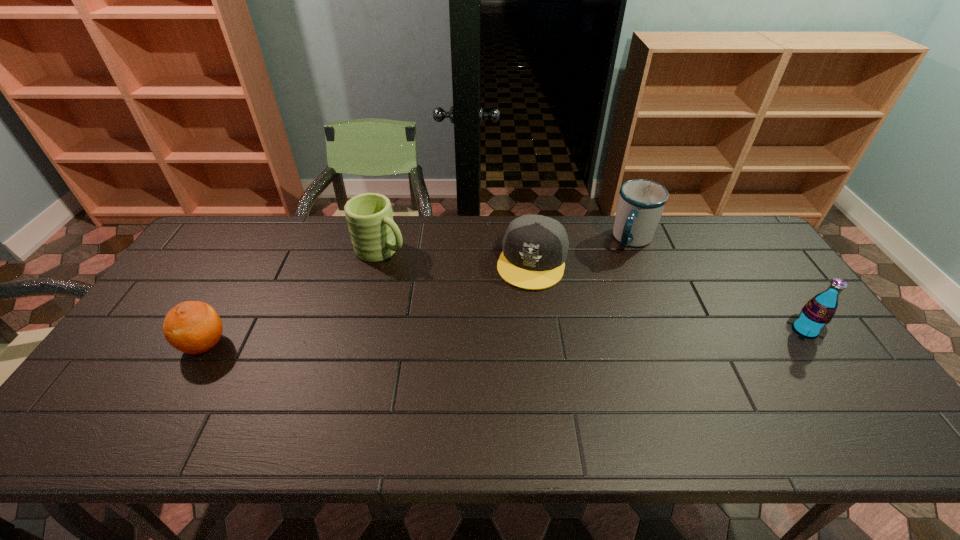
Where is `vacant area that lies between the soda and the second object from left to right`? This screenshot has height=540, width=960. vacant area that lies between the soda and the second object from left to right is located at coordinates (593, 291).

In order to click on free space between the orange and the soda in this screenshot , I will do `click(505, 337)`.

At what (x,y) coordinates should I click in order to perform the action: click on unoccupied area between the third object from right to left and the orange. Please return your answer as a coordinate pair (x, y). Looking at the image, I should click on (369, 302).

This screenshot has width=960, height=540. What are the coordinates of `unoccupied area between the orange and the rightmost object` in the screenshot? It's located at (505, 337).

In order to click on object that is the fourth nearest to the cap in this screenshot , I will do [x=193, y=327].

I want to click on object that is the closest to the left mug, so click(x=535, y=247).

Identify the location of free location that satisfies the following two spatial constraints: 1. on the back side of the third object from left to right; 2. on the right side of the leftmost object. This screenshot has height=540, width=960. (252, 260).